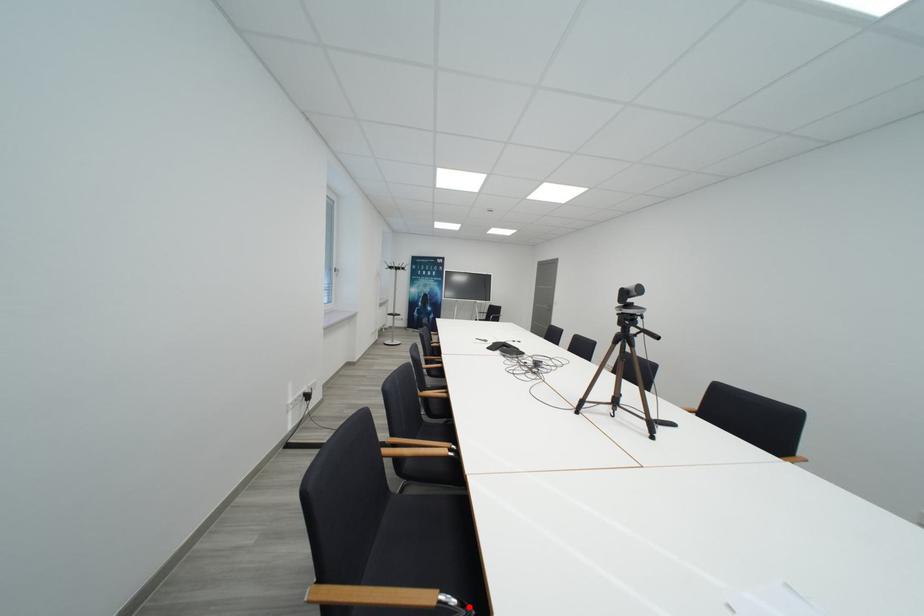
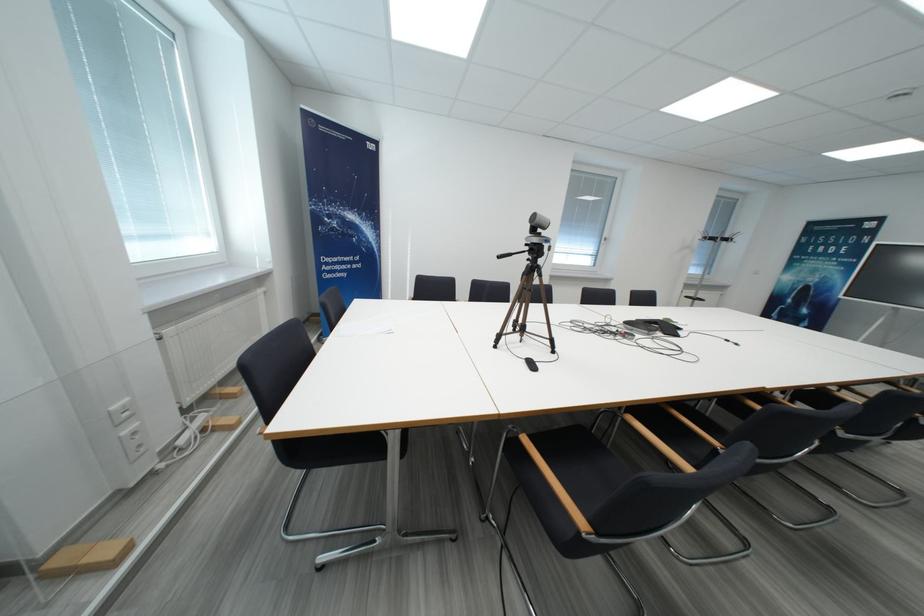
Question: I am providing you with two images of the same scene from different viewpoints. A red point is marked on the first image. Can you still see the location of the red point in image 2?

Choices:
 (A) Yes
 (B) No

Answer: (B)